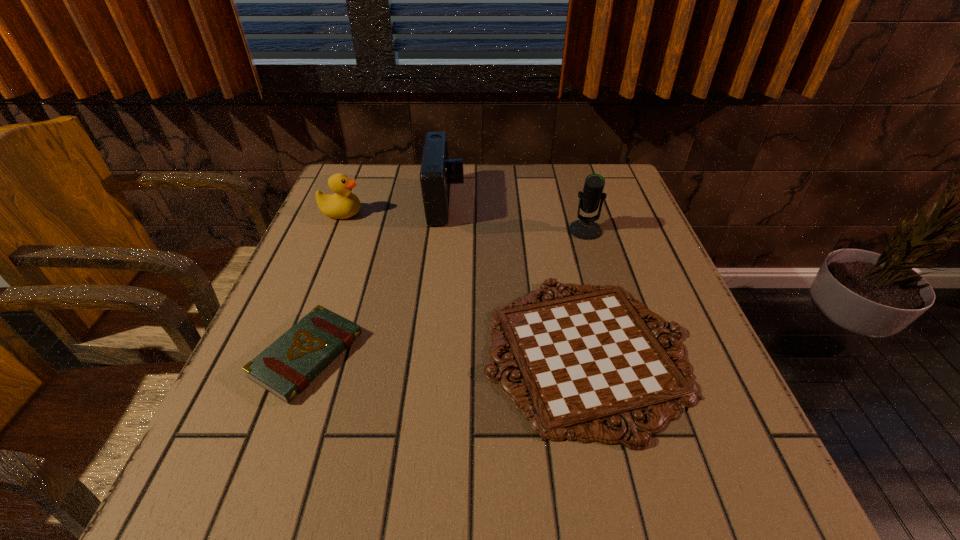
Identify the location of the third object from right to left. Image resolution: width=960 pixels, height=540 pixels. (437, 172).

Where is `microphone`? This screenshot has height=540, width=960. microphone is located at coordinates (585, 228).

Identify the location of duck. (343, 204).

You are a GUI agent. You are given a task and a screenshot of the screen. Output one action in this format:
    pyautogui.click(x=<x>, y=<y>)
    Task: Click on the fourth tallest object
    Image resolution: width=960 pixels, height=540 pixels.
    Given the screenshot: What is the action you would take?
    pyautogui.click(x=285, y=368)

Locate an element on the screen. the shortest object is located at coordinates (586, 359).

Image resolution: width=960 pixels, height=540 pixels. Identify the location of vacant space located on the front-facing side of the third object from right to left. (613, 204).

Where is `free space located on the front of the microphone`? The image size is (960, 540). free space located on the front of the microphone is located at coordinates (611, 313).

Where is `vacant region located at the beak of the third shortest object`? vacant region located at the beak of the third shortest object is located at coordinates (513, 213).

The height and width of the screenshot is (540, 960). What are the coordinates of `free point located on the right of the second shortest object` in the screenshot? It's located at (396, 355).

This screenshot has width=960, height=540. What are the coordinates of `vacant space located 0.220m on the back of the shortest object` in the screenshot? It's located at (558, 224).